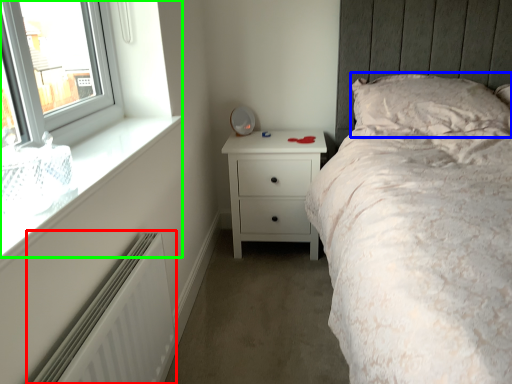
Question: Estimate the real-world distances between objects in this image. Which object is closer to radiator (highlighted by a red box), pillow (highlighted by a blue box) or window (highlighted by a green box)?

Choices:
 (A) pillow
 (B) window

Answer: (B)